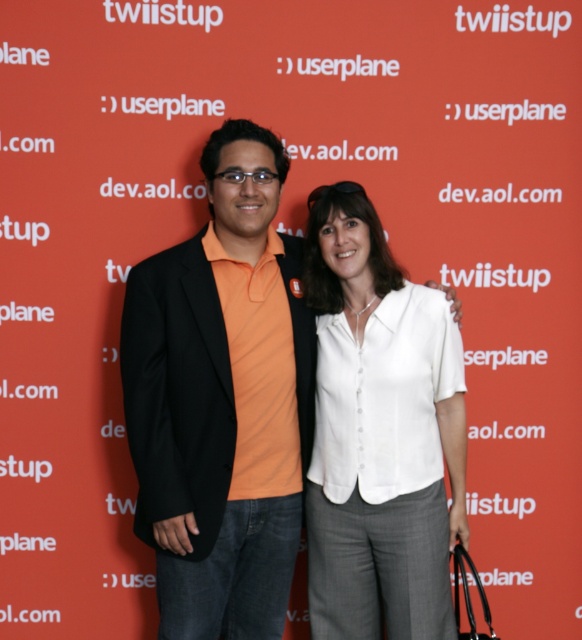
From the picture: You are a fashion designer observing the scene. You notice the orange cotton shirt at center and the white cotton blouse at center. Which one is positioned higher in the image?

The orange cotton shirt at center is positioned higher than the white cotton blouse at center.

You are standing in front of the backdrop with the words twiistup, userplane, dev.aol.com, and aol.com. You notice two points marked on the backdrop at coordinates point (190, 550) and point (384, 488). Which point is closer to you?

Point (190, 550) is in front of point (384, 488), so it is closer to you.